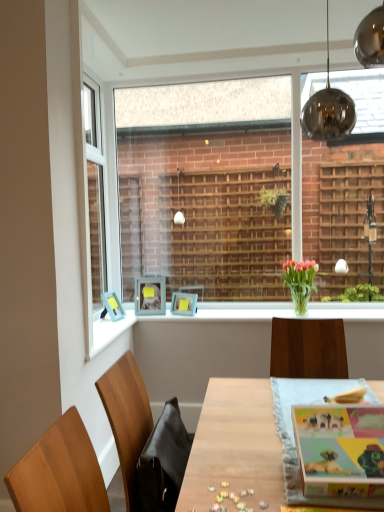
Question: Relative to wooden table at center, is translucent glass vase at center in front or behind?

Choices:
 (A) behind
 (B) front

Answer: (A)

Question: From the image's perspective, is translucent glass vase at center located above or below wooden table at center?

Choices:
 (A) below
 (B) above

Answer: (B)

Question: Estimate the real-world distances between objects in this image. Which object is farther from the wooden table at center?

Choices:
 (A) clear glass window at center
 (B) translucent glass vase at center
 (C) multicolored paper magazine at center
 (D) light blue plastic picture frame at upper left, the 2th picture frame viewed from the left
 (E) matte blue picture frame at center, arranged as the 1th picture frame when viewed from the right

Answer: (A)

Question: Based on their relative distances, which object is farther from the black leather swivel chair at lower left?

Choices:
 (A) clear glass window at center
 (B) light blue plastic picture frame at upper left, the 2th picture frame viewed from the left
 (C) wooden table at center
 (D) white glossy window sill at center
 (E) matte blue picture frame at center, the 3th picture frame when ordered from left to right

Answer: (A)